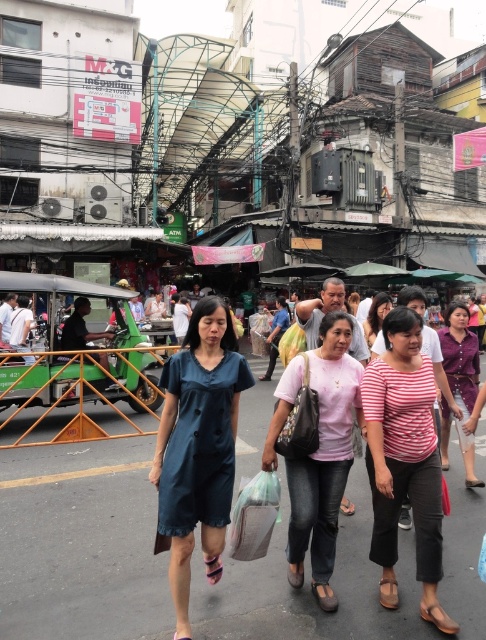
Question: Which of these objects is positioned closest to the translucent plastic bag at center?

Choices:
 (A) pink matte shirt at center
 (B) purple satin blouse at center

Answer: (B)

Question: Considering the real-world distances, which object is closest to the pink matte shirt at center?

Choices:
 (A) striped cotton shirt at center
 (B) translucent plastic bag at center
 (C) purple satin blouse at center

Answer: (C)

Question: Does striped cotton shirt at center have a larger size compared to pink cotton shirt at center?

Choices:
 (A) no
 (B) yes

Answer: (A)

Question: Is pink cotton shirt at center bigger than translucent plastic bag at center?

Choices:
 (A) yes
 (B) no

Answer: (A)

Question: Can you confirm if matte blue dress at center is thinner than striped cotton shirt at center?

Choices:
 (A) no
 (B) yes

Answer: (A)

Question: Which point appears closest to the camera in this image?

Choices:
 (A) (369, 310)
 (B) (249, 499)

Answer: (B)